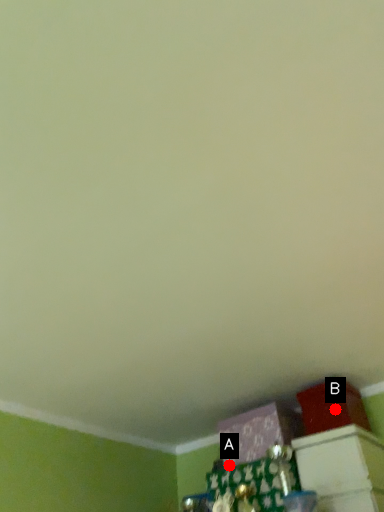
Question: Two points are circled on the image, labeled by A and B beside each circle. Among these points, which one is farthest from the camera?

Choices:
 (A) A is further
 (B) B is further

Answer: (A)